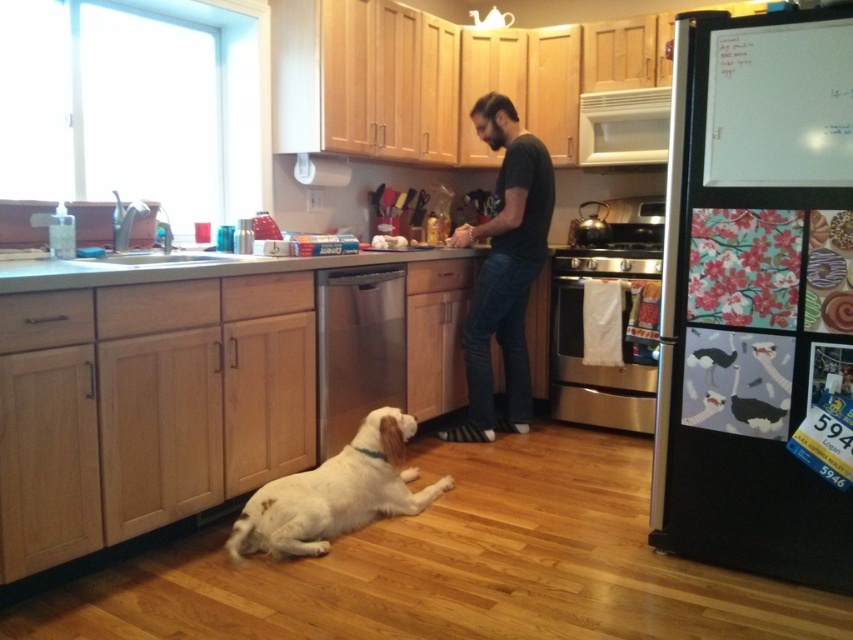
Question: Which point is closer to the camera?

Choices:
 (A) (473, 420)
 (B) (599, 160)
 (C) (399, 266)
 (D) (6, 289)

Answer: (D)

Question: Can you confirm if white fur dog at lower center is positioned below smooth granite countertop at center?

Choices:
 (A) yes
 (B) no

Answer: (A)

Question: Is the position of black cotton shirt at center less distant than that of stainless steel dishwasher at center?

Choices:
 (A) yes
 (B) no

Answer: (B)

Question: Estimate the real-world distances between objects in this image. Which object is closer to the white fur dog at lower center?

Choices:
 (A) smooth granite countertop at center
 (B) white glossy exhaust hood at upper center
 (C) stainless steel dishwasher at center

Answer: (C)

Question: Which point is closer to the camera?

Choices:
 (A) (380, 348)
 (B) (161, 259)

Answer: (B)

Question: Is white fur dog at lower center to the right of stainless steel dishwasher at center from the viewer's perspective?

Choices:
 (A) no
 (B) yes

Answer: (A)